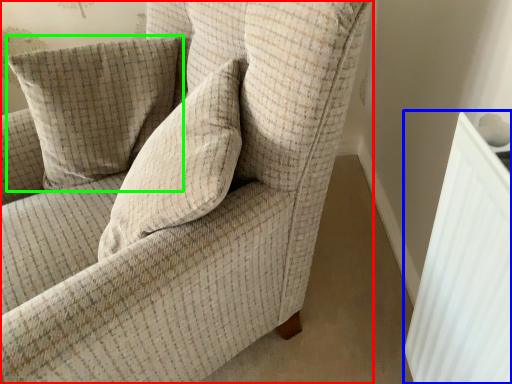
Question: Estimate the real-world distances between objects in this image. Which object is closer to chair (highlighted by a red box), radiator (highlighted by a blue box) or pillow (highlighted by a green box)?

Choices:
 (A) radiator
 (B) pillow

Answer: (B)